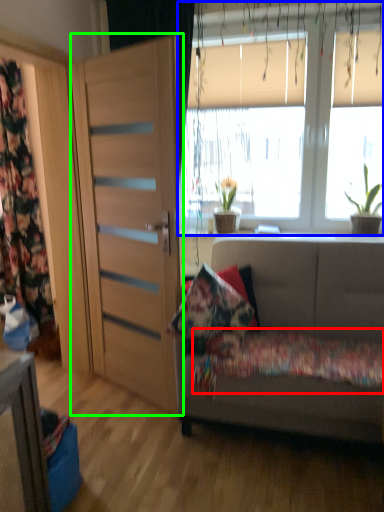
Question: Which is nearer to the bedding (highlighted by a red box)? window (highlighted by a blue box) or door (highlighted by a green box).

Choices:
 (A) window
 (B) door

Answer: (B)